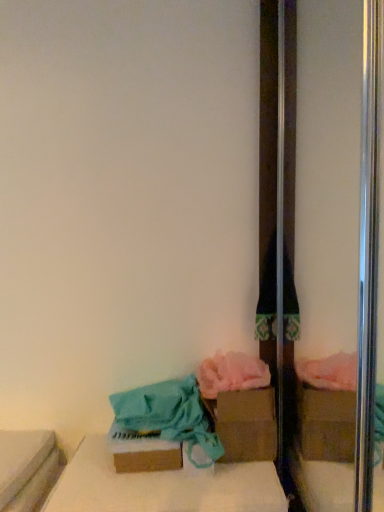
Describe the element at coordinates (142, 451) in the screenshot. I see `brown cardboard box at lower center, the second cardboard box from the back` at that location.

Locate an element on the screen. brown cardboard box at lower center is located at coordinates pyautogui.click(x=162, y=486).

Where is `pink fluffy towel at lower center, which is the 2th material from left to right`? The height and width of the screenshot is (512, 384). pink fluffy towel at lower center, which is the 2th material from left to right is located at coordinates tap(231, 374).

Describe the element at coordinates (168, 417) in the screenshot. I see `teal fabric bag at lower left, the 2th material in the right-to-left sequence` at that location.

Measure the distance between point (231,408) and camera.

Point (231,408) and camera are 1.12 meters apart.

You are a GUI agent. You are given a task and a screenshot of the screen. Output one action in this format:
    pyautogui.click(x=<x>, y=<y>)
    Task: Click on the brown cardboard box at lower center, the first cardboard box positioned from the front
    Image resolution: width=384 pixels, height=512 pixels.
    Given the screenshot: What is the action you would take?
    pyautogui.click(x=142, y=451)

In the scene shown: From a real-world perspective, who is located lower, brown cardboard box at lower center or brown cardboard box at center, the second cardboard box from the front?

brown cardboard box at lower center is physically lower.

Which is nearer, (228, 500) or (224, 459)?

Point (228, 500).

Could you tell me if brown cardboard box at lower center is facing brown cardboard box at center, placed as the 1th cardboard box when sorted from back to front?

No.

Is brown cardboard box at center, arranged as the second cardboard box when viewed from the left, closer to camera compared to pink fluffy towel at lower center, marked as the first material in a right-to-left arrangement?

No, brown cardboard box at center, arranged as the second cardboard box when viewed from the left, is behind pink fluffy towel at lower center, marked as the first material in a right-to-left arrangement.

Does point (248, 440) lie in front of point (224, 369)?

Yes, it is in front of point (224, 369).

Between brown cardboard box at center, the first cardboard box from the right, and pink fluffy towel at lower center, marked as the first material in a right-to-left arrangement, which one has smaller width?

pink fluffy towel at lower center, marked as the first material in a right-to-left arrangement, is thinner.

In the scene shown: Can we say pink fluffy towel at lower center, marked as the first material in a right-to-left arrangement, lies outside brown cardboard box at lower center?

Yes, pink fluffy towel at lower center, marked as the first material in a right-to-left arrangement, is outside of brown cardboard box at lower center.

Where is `furniture lying on the left of pink fluffy towel at lower center, which is the 2th material from left to right`? furniture lying on the left of pink fluffy towel at lower center, which is the 2th material from left to right is located at coordinates coord(162,486).

Can you see pink fluffy towel at lower center, marked as the first material in a right-to-left arrangement, touching brown cardboard box at lower center?

No, pink fluffy towel at lower center, marked as the first material in a right-to-left arrangement, is not beside brown cardboard box at lower center.

Is brown cardboard box at center, placed as the 1th cardboard box when sorted from back to front, positioned with its back to teal fabric bag at lower left, the 2th material in the right-to-left sequence?

No, brown cardboard box at center, placed as the 1th cardboard box when sorted from back to front, is not facing the opposite direction of teal fabric bag at lower left, the 2th material in the right-to-left sequence.

Considering the sizes of brown cardboard box at center, arranged as the second cardboard box when viewed from the left, and teal fabric bag at lower left, the 2th material in the right-to-left sequence, in the image, is brown cardboard box at center, arranged as the second cardboard box when viewed from the left, wider or thinner than teal fabric bag at lower left, the 2th material in the right-to-left sequence,?

Clearly, brown cardboard box at center, arranged as the second cardboard box when viewed from the left, has less width compared to teal fabric bag at lower left, the 2th material in the right-to-left sequence.

Is brown cardboard box at center, the second cardboard box from the front, positioned before teal fabric bag at lower left, the 2th material in the right-to-left sequence?

No, brown cardboard box at center, the second cardboard box from the front, is further to the viewer.

From the image's perspective, which one is positioned higher, brown cardboard box at center, placed as the 1th cardboard box when sorted from back to front, or teal fabric bag at lower left, the 2th material in the right-to-left sequence?

brown cardboard box at center, placed as the 1th cardboard box when sorted from back to front, appears higher in the image.

Between brown cardboard box at lower center, the first cardboard box positioned from the front, and brown cardboard box at lower center, which one is positioned in front?

brown cardboard box at lower center is more forward.

Is brown cardboard box at lower center, which is the second cardboard box from right to left, at the left side of brown cardboard box at lower center?

Correct, you'll find brown cardboard box at lower center, which is the second cardboard box from right to left, to the left of brown cardboard box at lower center.

Consider the image. Can you tell me how much brown cardboard box at lower center, which is the second cardboard box from right to left, and brown cardboard box at lower center differ in facing direction?

2.45 degrees separate the facing orientations of brown cardboard box at lower center, which is the second cardboard box from right to left, and brown cardboard box at lower center.

Is brown cardboard box at lower center in front of teal fabric bag at lower left, the first material in the left-to-right sequence?

Yes.

Considering the relative sizes of brown cardboard box at lower center and teal fabric bag at lower left, the first material in the left-to-right sequence, in the image provided, is brown cardboard box at lower center smaller than teal fabric bag at lower left, the first material in the left-to-right sequence,?

Yes.

Which object is wider, brown cardboard box at lower center or teal fabric bag at lower left, the first material in the left-to-right sequence?

With larger width is brown cardboard box at lower center.

Between point (163, 466) and point (161, 434), which one is positioned in front?

Positioned in front is point (163, 466).

Is brown cardboard box at lower center, the first cardboard box positioned from the front, positioned with its back to teal fabric bag at lower left, the 2th material in the right-to-left sequence?

That's right, brown cardboard box at lower center, the first cardboard box positioned from the front, is facing away from teal fabric bag at lower left, the 2th material in the right-to-left sequence.

Can we say brown cardboard box at lower center, which is the 1th cardboard box from left to right, lies outside teal fabric bag at lower left, the first material in the left-to-right sequence?

That's incorrect, brown cardboard box at lower center, which is the 1th cardboard box from left to right, is not completely outside teal fabric bag at lower left, the first material in the left-to-right sequence.

From a real-world perspective, does brown cardboard box at lower center, the first cardboard box positioned from the front, sit lower than teal fabric bag at lower left, the first material in the left-to-right sequence?

Indeed, from a real-world perspective, brown cardboard box at lower center, the first cardboard box positioned from the front, is positioned beneath teal fabric bag at lower left, the first material in the left-to-right sequence.

There is a brown cardboard box at lower center. Where is `the 2nd cardboard box above it (from a real-world perspective)`? The height and width of the screenshot is (512, 384). the 2nd cardboard box above it (from a real-world perspective) is located at coordinates 245,424.

Locate an element on the screen. Image resolution: width=384 pixels, height=512 pixels. cardboard box on the right of pink fluffy towel at lower center, marked as the first material in a right-to-left arrangement is located at coordinates (245, 424).

Looking at the image, which one is located closer to pink fluffy towel at lower center, which is the 2th material from left to right, teal fabric bag at lower left, the first material in the left-to-right sequence, or brown cardboard box at center, the first cardboard box from the right?

Among the two, brown cardboard box at center, the first cardboard box from the right, is located nearer to pink fluffy towel at lower center, which is the 2th material from left to right.

Estimate the real-world distances between objects in this image. Which object is further from teal fabric bag at lower left, the first material in the left-to-right sequence, pink fluffy towel at lower center, marked as the first material in a right-to-left arrangement, or brown cardboard box at lower center, which is the 1th cardboard box from left to right?

pink fluffy towel at lower center, marked as the first material in a right-to-left arrangement.

In the scene shown: Based on their spatial positions, is brown cardboard box at center, the second cardboard box from the front, or brown cardboard box at lower center further from pink fluffy towel at lower center, which is the 2th material from left to right?

Among the two, brown cardboard box at lower center is located further to pink fluffy towel at lower center, which is the 2th material from left to right.

Which object lies nearer to the anchor point brown cardboard box at center, the second cardboard box from the front, brown cardboard box at lower center, which is the 1th cardboard box from left to right, or brown cardboard box at lower center?

Among the two, brown cardboard box at lower center is located nearer to brown cardboard box at center, the second cardboard box from the front.

When comparing their distances from brown cardboard box at center, arranged as the second cardboard box when viewed from the left, does teal fabric bag at lower left, the 2th material in the right-to-left sequence, or pink fluffy towel at lower center, marked as the first material in a right-to-left arrangement, seem further?

The object further to brown cardboard box at center, arranged as the second cardboard box when viewed from the left, is teal fabric bag at lower left, the 2th material in the right-to-left sequence.

When comparing their distances from teal fabric bag at lower left, the first material in the left-to-right sequence, does brown cardboard box at center, placed as the 1th cardboard box when sorted from back to front, or brown cardboard box at lower center seem closer?

brown cardboard box at center, placed as the 1th cardboard box when sorted from back to front, is positioned closer to the anchor teal fabric bag at lower left, the first material in the left-to-right sequence.

From the picture: Which object lies further to the anchor point teal fabric bag at lower left, the first material in the left-to-right sequence, pink fluffy towel at lower center, which is the 2th material from left to right, or brown cardboard box at center, the second cardboard box from the front?

pink fluffy towel at lower center, which is the 2th material from left to right, lies further to teal fabric bag at lower left, the first material in the left-to-right sequence, than the other object.

Looking at the image, which one is located closer to brown cardboard box at lower center, the second cardboard box from the back, brown cardboard box at center, placed as the 1th cardboard box when sorted from back to front, or pink fluffy towel at lower center, marked as the first material in a right-to-left arrangement?

brown cardboard box at center, placed as the 1th cardboard box when sorted from back to front, lies closer to brown cardboard box at lower center, the second cardboard box from the back, than the other object.

Locate an element on the screen. This screenshot has width=384, height=512. furniture between teal fabric bag at lower left, the 2th material in the right-to-left sequence, and brown cardboard box at center, placed as the 1th cardboard box when sorted from back to front, in the horizontal direction is located at coordinates (162, 486).

Locate an element on the screen. furniture between teal fabric bag at lower left, the 2th material in the right-to-left sequence, and pink fluffy towel at lower center, which is the 2th material from left to right, in the horizontal direction is located at coordinates (162, 486).

Locate an element on the screen. This screenshot has height=512, width=384. furniture between brown cardboard box at lower center, which is the 1th cardboard box from left to right, and pink fluffy towel at lower center, marked as the first material in a right-to-left arrangement, in the horizontal direction is located at coordinates (162, 486).

You are a GUI agent. You are given a task and a screenshot of the screen. Output one action in this format:
    pyautogui.click(x=<x>, y=<y>)
    Task: Click on the material situated between brown cardboard box at lower center and brown cardboard box at center, the second cardboard box from the front, from left to right
    This screenshot has height=512, width=384.
    Given the screenshot: What is the action you would take?
    pyautogui.click(x=231, y=374)